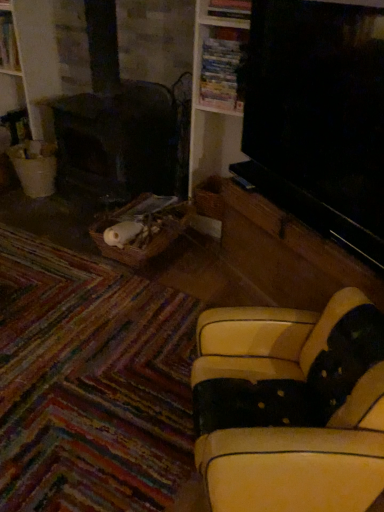
Find the location of `wooden bookshelf at upper center`. wooden bookshelf at upper center is located at coordinates (222, 68).

In order to face wooden bookshelf at upper center, should I rotate leftwards or rightwards?

It's best to rotate right around 4.817 degrees.

Locate an element on the screen. This screenshot has width=384, height=512. leather-like yellow couch at lower right is located at coordinates (x=291, y=407).

Locate an element on the screen. The width and height of the screenshot is (384, 512). white painted wood bookshelf at upper left is located at coordinates (36, 60).

Is white painted wood bookshelf at upper left next to wooden bookshelf at upper center?

No, white painted wood bookshelf at upper left is not making contact with wooden bookshelf at upper center.

In terms of height, does white painted wood bookshelf at upper left look taller or shorter compared to wooden bookshelf at upper center?

Clearly, white painted wood bookshelf at upper left is taller compared to wooden bookshelf at upper center.

From the image's perspective, would you say white painted wood bookshelf at upper left is shown under wooden bookshelf at upper center?

Actually, white painted wood bookshelf at upper left appears above wooden bookshelf at upper center in the image.

How far apart are white painted wood bookshelf at upper left and wooden bookshelf at upper center?

white painted wood bookshelf at upper left and wooden bookshelf at upper center are 1.20 meters apart.

Is white painted wood bookshelf at upper left bigger than leather-like yellow couch at lower right?

Incorrect, white painted wood bookshelf at upper left is not larger than leather-like yellow couch at lower right.

Is white painted wood bookshelf at upper left shorter than leather-like yellow couch at lower right?

No.

Can you confirm if white painted wood bookshelf at upper left is wider than leather-like yellow couch at lower right?

No, white painted wood bookshelf at upper left is not wider than leather-like yellow couch at lower right.

Identify the location of studio couch below the white painted wood bookshelf at upper left (from a real-world perspective). The width and height of the screenshot is (384, 512). (291, 407).

Considering the positions of objects wooden bookshelf at upper center and white painted wood bookshelf at upper left in the image provided, who is more to the left, wooden bookshelf at upper center or white painted wood bookshelf at upper left?

white painted wood bookshelf at upper left.

From a real-world perspective, is wooden bookshelf at upper center positioned above or below white painted wood bookshelf at upper left?

From a real-world perspective, wooden bookshelf at upper center is physically above white painted wood bookshelf at upper left.

Could you tell me if wooden bookshelf at upper center is turned towards white painted wood bookshelf at upper left?

No, wooden bookshelf at upper center is not turned towards white painted wood bookshelf at upper left.

Can you confirm if wooden bookshelf at upper center is wider than white painted wood bookshelf at upper left?

No, wooden bookshelf at upper center is not wider than white painted wood bookshelf at upper left.

Considering the relative positions of leather-like yellow couch at lower right and wooden bookshelf at upper center in the image provided, is leather-like yellow couch at lower right to the left of wooden bookshelf at upper center from the viewer's perspective?

In fact, leather-like yellow couch at lower right is to the right of wooden bookshelf at upper center.

Which is nearer, (282, 389) or (224, 106)?

Point (282, 389)

Is leather-like yellow couch at lower right positioned beyond the bounds of wooden bookshelf at upper center?

Yes, leather-like yellow couch at lower right is not within wooden bookshelf at upper center.

From the image's perspective, is leather-like yellow couch at lower right on white painted wood bookshelf at upper left?

Incorrect, from the image's perspective, leather-like yellow couch at lower right is lower than white painted wood bookshelf at upper left.

Is leather-like yellow couch at lower right to the left or to the right of white painted wood bookshelf at upper left in the image?

leather-like yellow couch at lower right is to the right of white painted wood bookshelf at upper left.

Is leather-like yellow couch at lower right situated inside white painted wood bookshelf at upper left or outside?

leather-like yellow couch at lower right lies outside white painted wood bookshelf at upper left.

Is point (300, 399) closer to camera compared to point (43, 22)?

Yes, it is in front of point (43, 22).

Who is shorter, wooden bookshelf at upper center or leather-like yellow couch at lower right?

With less height is wooden bookshelf at upper center.

Consider the image. Considering the relative sizes of wooden bookshelf at upper center and leather-like yellow couch at lower right in the image provided, is wooden bookshelf at upper center smaller than leather-like yellow couch at lower right?

Indeed, wooden bookshelf at upper center has a smaller size compared to leather-like yellow couch at lower right.

Is wooden bookshelf at upper center outside of leather-like yellow couch at lower right?

Yes, wooden bookshelf at upper center is not within leather-like yellow couch at lower right.

Could you tell me if wooden bookshelf at upper center is turned towards leather-like yellow couch at lower right?

No, wooden bookshelf at upper center is not turned towards leather-like yellow couch at lower right.

Find the location of a particular element. bookshelf below the wooden bookshelf at upper center (from a real-world perspective) is located at coordinates (36, 60).

At what (x,y) coordinates should I click in order to perform the action: click on studio couch in front of the white painted wood bookshelf at upper left. Please return your answer as a coordinate pair (x, y). Looking at the image, I should click on (291, 407).

Based on the photo, looking at the image, which one is located further to wooden bookshelf at upper center, white painted wood bookshelf at upper left or leather-like yellow couch at lower right?

Based on the image, leather-like yellow couch at lower right appears to be further to wooden bookshelf at upper center.

Which object lies further to the anchor point leather-like yellow couch at lower right, wooden bookshelf at upper center or white painted wood bookshelf at upper left?

white painted wood bookshelf at upper left lies further to leather-like yellow couch at lower right than the other object.

Considering their positions, is leather-like yellow couch at lower right positioned closer to white painted wood bookshelf at upper left than wooden bookshelf at upper center?

wooden bookshelf at upper center is positioned closer to the anchor white painted wood bookshelf at upper left.

Considering their positions, is leather-like yellow couch at lower right positioned closer to wooden bookshelf at upper center than white painted wood bookshelf at upper left?

white painted wood bookshelf at upper left.

Looking at the image, which one is located further to leather-like yellow couch at lower right, white painted wood bookshelf at upper left or wooden bookshelf at upper center?

white painted wood bookshelf at upper left.

Looking at the image, which one is located further to white painted wood bookshelf at upper left, wooden bookshelf at upper center or leather-like yellow couch at lower right?

The object further to white painted wood bookshelf at upper left is leather-like yellow couch at lower right.

The width and height of the screenshot is (384, 512). Identify the location of shelf between white painted wood bookshelf at upper left and leather-like yellow couch at lower right in the horizontal direction. tap(222, 68).